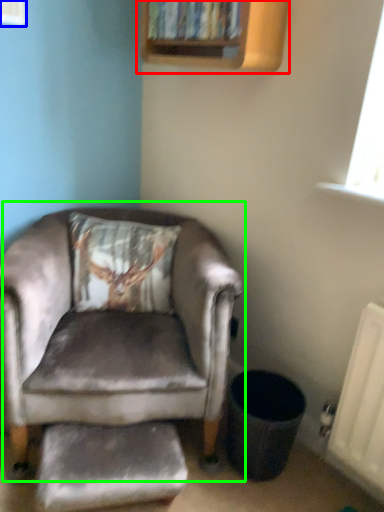
Question: Based on their relative distances, which object is farther from bookshelf (highlighted by a red box)? Choose from window (highlighted by a blue box) and chair (highlighted by a green box).

Choices:
 (A) window
 (B) chair

Answer: (B)